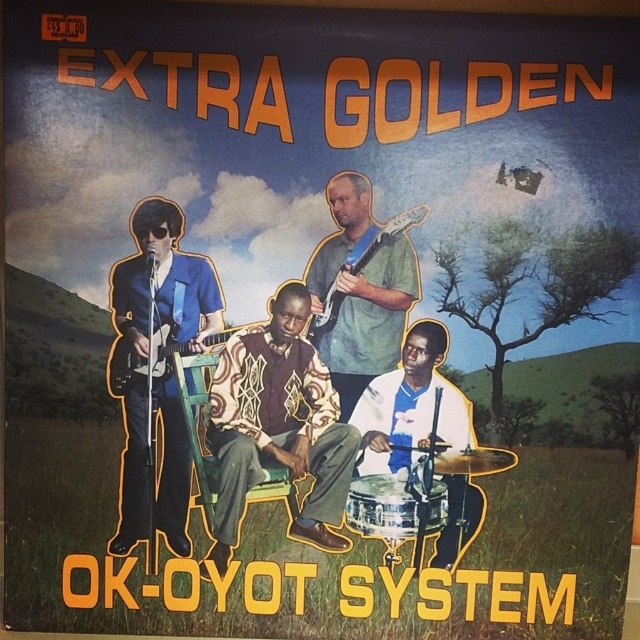
Is green matte guitar at center positioned before wooden chair at center?

Yes.

Which of these two, green matte guitar at center or wooden chair at center, stands shorter?

With less height is wooden chair at center.

Describe the element at coordinates (360, 292) in the screenshot. I see `green matte guitar at center` at that location.

Locate an element on the screen. This screenshot has height=640, width=640. green matte guitar at center is located at coordinates (360, 292).

The width and height of the screenshot is (640, 640). What do you see at coordinates (276, 424) in the screenshot?
I see `patterned fabric shirt at center` at bounding box center [276, 424].

Measure the distance between patterned fabric shirt at center and white fabric shirt at center.

patterned fabric shirt at center and white fabric shirt at center are 4.90 inches apart.

Is point (248, 340) less distant than point (364, 458)?

Yes, point (248, 340) is in front of point (364, 458).

Locate an element on the screen. patterned fabric shirt at center is located at coordinates (276, 424).

This screenshot has height=640, width=640. Describe the element at coordinates (147, 337) in the screenshot. I see `matte blue suit at left` at that location.

What do you see at coordinates (147, 337) in the screenshot? I see `matte blue suit at left` at bounding box center [147, 337].

Locate an element on the screen. The image size is (640, 640). matte blue suit at left is located at coordinates (147, 337).